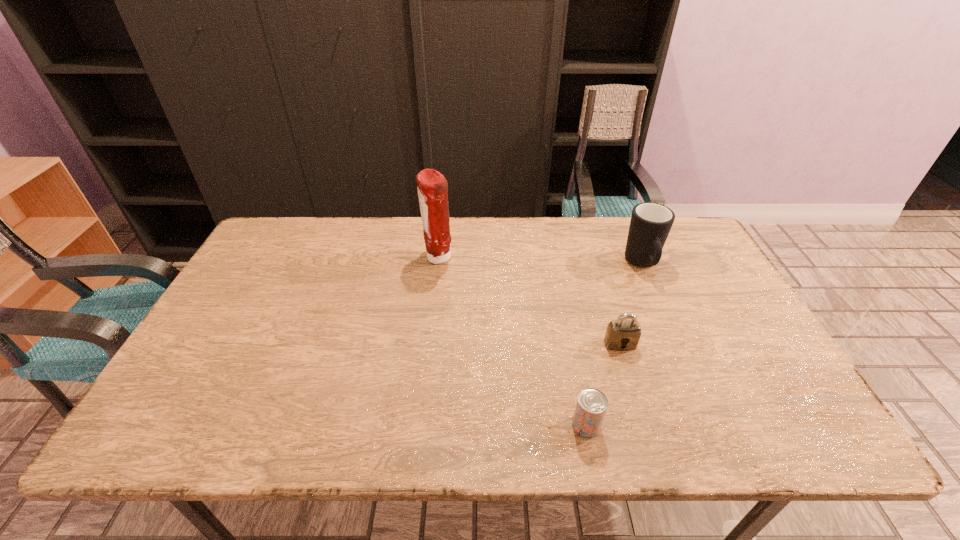
You are a GUI agent. You are given a task and a screenshot of the screen. Output one action in this format:
    pyautogui.click(x=<x>, y=<y>)
    Task: Click on the vacant area at the far left corner of the desktop
    The height and width of the screenshot is (540, 960).
    Given the screenshot: What is the action you would take?
    pyautogui.click(x=313, y=227)

Locate an element on the screen. vacant space at the near left corner of the desktop is located at coordinates (148, 434).

At what (x,y) coordinates should I click in order to perform the action: click on vacant space at the far right corner of the desktop. Please return your answer as a coordinate pair (x, y). Looking at the image, I should click on (697, 242).

In the image, there is a desktop. Identify the location of vacant space at the near right corner. (808, 420).

Where is `vacant area between the second tallest object and the condiment`? The image size is (960, 540). vacant area between the second tallest object and the condiment is located at coordinates [540, 261].

This screenshot has width=960, height=540. I want to click on free space between the second nearest object and the rightmost object, so click(632, 305).

The height and width of the screenshot is (540, 960). I want to click on empty location between the nearest object and the tallest object, so click(512, 342).

At what (x,y) coordinates should I click in order to perform the action: click on vacant area between the rightmost object and the third farthest object. Please return your answer as a coordinate pair (x, y). This screenshot has width=960, height=540. Looking at the image, I should click on (632, 305).

Where is `vacant region between the beer can and the condiment`? vacant region between the beer can and the condiment is located at coordinates (512, 342).

In order to click on free point between the mug and the padlock in this screenshot , I will do `click(632, 305)`.